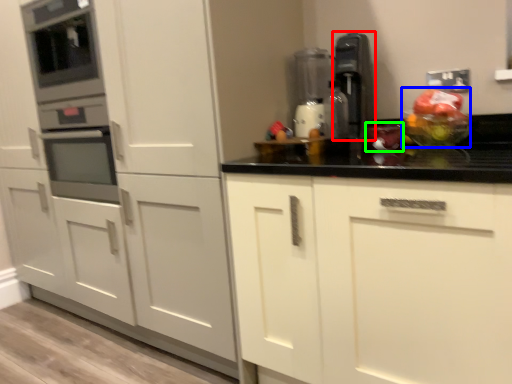
Question: Which object is positioned farthest from kitchen appliance (highlighted by a red box)? Select from fruit salad (highlighted by a blue box) and food (highlighted by a green box).

Choices:
 (A) fruit salad
 (B) food

Answer: (A)